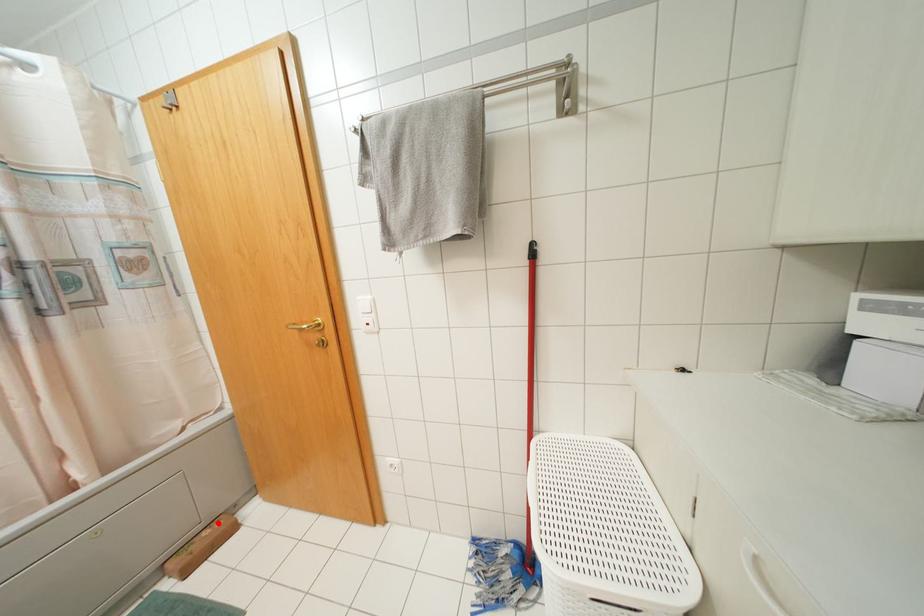
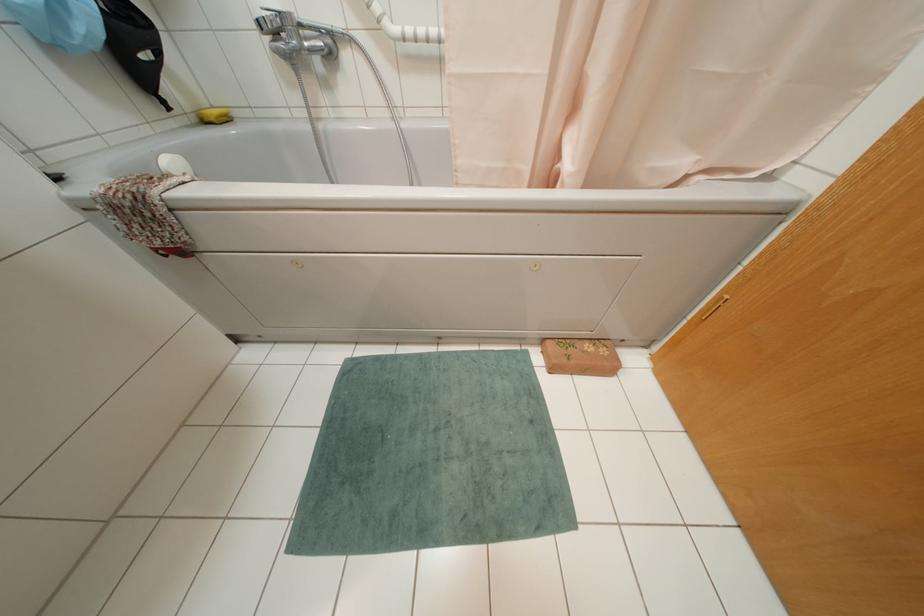
Locate, in the second image, the point that corresponds to the highlighted location in the first image.

(602, 351)